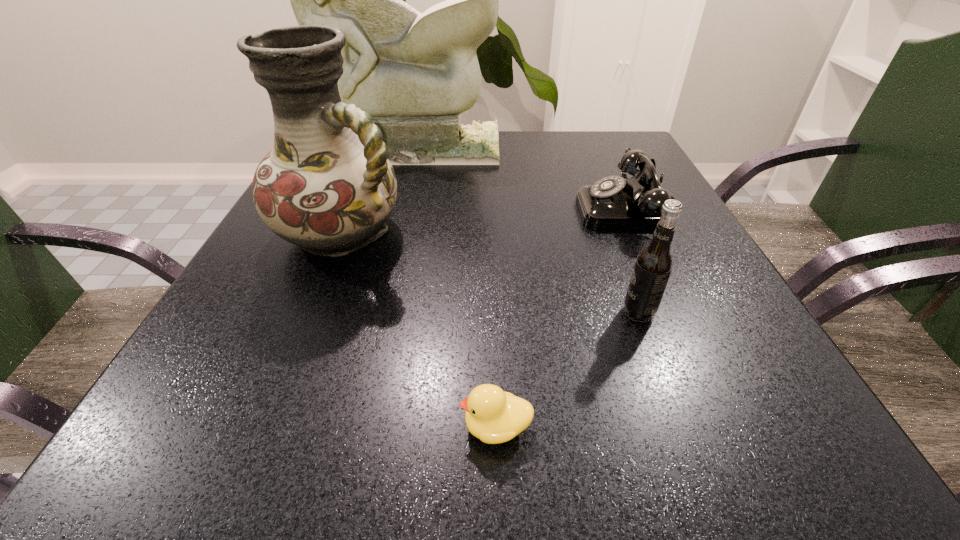
You are a GUI agent. You are given a task and a screenshot of the screen. Output one action in this format:
    pyautogui.click(x=<x>, y=<y>)
    Task: Click on the farthest object
    
    Given the screenshot: What is the action you would take?
    pyautogui.click(x=414, y=73)

This screenshot has width=960, height=540. Identify the location of vase. (327, 185).

Find the location of `the third shortest object`. the third shortest object is located at coordinates (654, 263).

The height and width of the screenshot is (540, 960). I want to click on the second nearest object, so click(x=654, y=263).

Find the location of a particular element. telephone is located at coordinates (614, 202).

Where is `the shortest object`? Image resolution: width=960 pixels, height=540 pixels. the shortest object is located at coordinates (493, 416).

I want to click on the nearest object, so click(x=493, y=416).

The height and width of the screenshot is (540, 960). Find the location of `free region located on the base of the farthest object`. free region located on the base of the farthest object is located at coordinates (398, 197).

What are the coordinates of `vacant space located on the back of the fourth shortest object` in the screenshot? It's located at (373, 154).

At what (x,y) coordinates should I click in order to perform the action: click on vacant point located 0.270m on the label of the root beer. Please return your answer as a coordinate pair (x, y). The image size is (960, 540). Looking at the image, I should click on (452, 312).